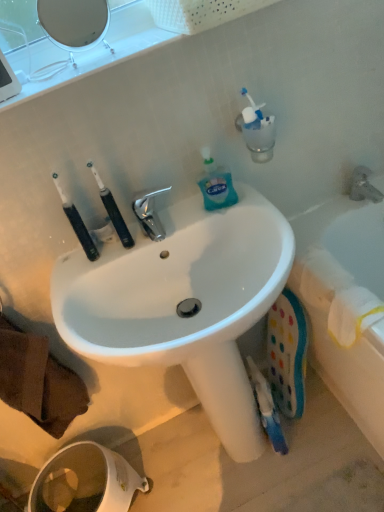
Question: Is white glossy mirror at upper left in front of or behind white glossy toilet paper at lower left in the image?

Choices:
 (A) behind
 (B) front

Answer: (B)

Question: From a real-world perspective, is white glossy mirror at upper left positioned above or below white glossy toilet paper at lower left?

Choices:
 (A) above
 (B) below

Answer: (A)

Question: Considering the real-world distances, which object is closest to the black rubber toothbrush at left?

Choices:
 (A) white plastic bathtub at right
 (B) white glossy mirror at upper left
 (C) translucent plastic bottle at upper right
 (D) black rubber toothbrushes at center
 (E) matte gray faucet at upper right

Answer: (D)

Question: Estimate the real-world distances between objects in this image. Which object is farther from the matte gray faucet at upper right?

Choices:
 (A) white glossy mirror at upper left
 (B) white plastic bathtub at right
 (C) black rubber toothbrushes at center
 (D) white glossy sink at center
 (E) white glossy toilet paper at lower left

Answer: (E)